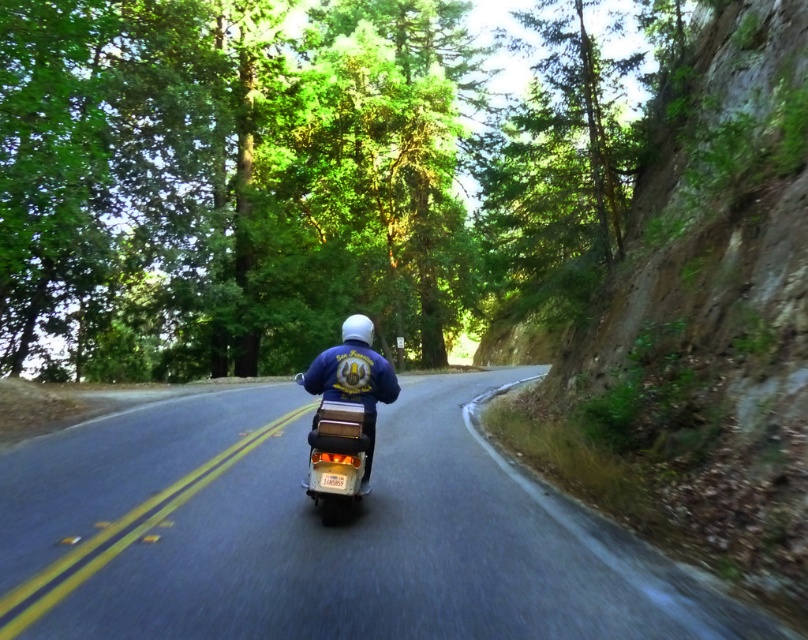
You are a GPS navigator planning a route for a delivery truck that must stay on the black asphalt road at center. The truck needs to pass through point (322, 534). Is this point on the road?

Yes, the point (322, 534) is on the black asphalt road at center according to the description.

You are a hiker standing at the edge of the forest. You see the black asphalt road at center and the blue denim jacket at center. Which object appears larger in the image?

The black asphalt road at center appears larger than the blue denim jacket at center because it is taller.

Based on the photo, you are a pedestrian standing on the black asphalt road at center. You see the metallic silver motorcycle at center approaching you. Is the motorcycle on the road?

The black asphalt road at center is 2.00 meters from metallic silver motorcycle at center, so the motorcycle is not on the road.